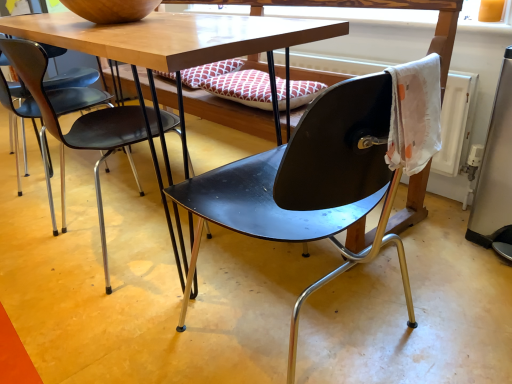
Question: From a real-world perspective, is matte black chair at center, placed as the 2th chair when sorted from left to right, physically located above or below matte black chair at center, acting as the 1th chair starting from the left?

Choices:
 (A) below
 (B) above

Answer: (B)

Question: Would you say matte black chair at center, placed as the 2th chair when sorted from left to right, is to the left or to the right of matte black chair at center, acting as the 1th chair starting from the left, in the picture?

Choices:
 (A) right
 (B) left

Answer: (A)

Question: Considering the positions of matte black chair at center, which is counted as the first chair, starting from the right, and matte black chair at center, acting as the 1th chair starting from the left, in the image, is matte black chair at center, which is counted as the first chair, starting from the right, wider or thinner than matte black chair at center, acting as the 1th chair starting from the left,?

Choices:
 (A) thin
 (B) wide

Answer: (B)

Question: Is matte black chair at center, the 2th chair in the right-to-left sequence, bigger or smaller than matte black chair at center, which is counted as the first chair, starting from the right?

Choices:
 (A) big
 (B) small

Answer: (B)

Question: Based on their positions, is matte black chair at center, the 2th chair in the right-to-left sequence, located to the left or right of matte black chair at center, which is counted as the first chair, starting from the right?

Choices:
 (A) right
 (B) left

Answer: (B)

Question: In terms of width, does matte black chair at center, acting as the 1th chair starting from the left, look wider or thinner when compared to matte black chair at center, which is counted as the first chair, starting from the right?

Choices:
 (A) wide
 (B) thin

Answer: (B)

Question: Does point (64, 206) appear closer or farther from the camera than point (365, 89)?

Choices:
 (A) closer
 (B) farther

Answer: (B)